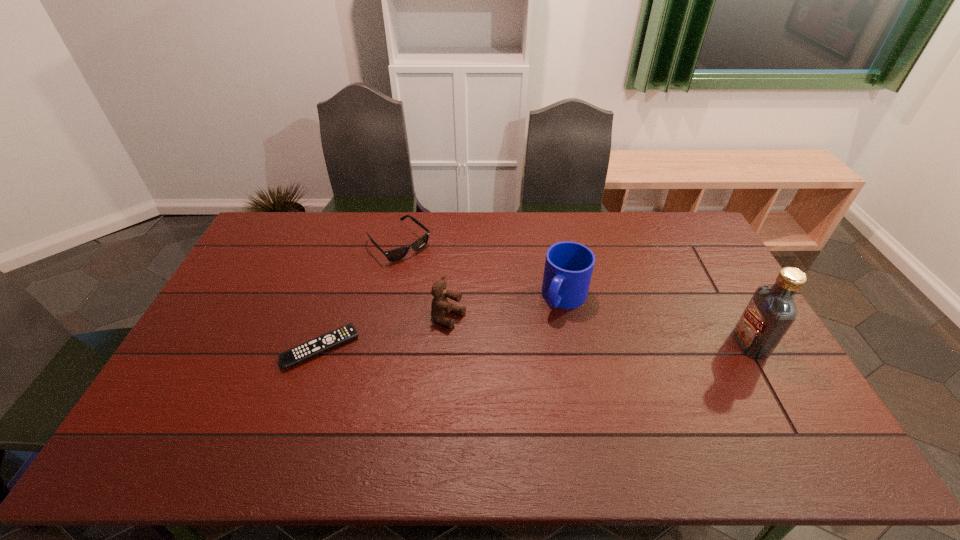
At what (x,y) coordinates should I click in order to perform the action: click on object situated at the far edge. Please return your answer as a coordinate pair (x, y). This screenshot has width=960, height=540. Looking at the image, I should click on (396, 254).

The height and width of the screenshot is (540, 960). What are the coordinates of `object positioned at the right edge` in the screenshot? It's located at (771, 311).

In the image, there is a desktop. Where is `vacant space at the far edge`? vacant space at the far edge is located at coordinates (525, 237).

In the image, there is a desktop. Where is `vacant space at the near edge`? vacant space at the near edge is located at coordinates (367, 390).

The image size is (960, 540). Identify the location of free space at the left edge. (268, 266).

In the image, there is a desktop. At what (x,y) coordinates should I click in order to perform the action: click on vacant space at the far left corner. Please return your answer as a coordinate pair (x, y). The width and height of the screenshot is (960, 540). Looking at the image, I should click on (261, 245).

This screenshot has height=540, width=960. In the image, there is a desktop. Identify the location of vacant space at the far right corner. (691, 218).

Find the location of a particular element. empty space between the teddy bear and the second shortest object is located at coordinates (424, 281).

Locate an element on the screen. free space between the farthest object and the mug is located at coordinates (482, 271).

The width and height of the screenshot is (960, 540). Identify the location of vacant space that's between the teddy bear and the farthest object. (424, 281).